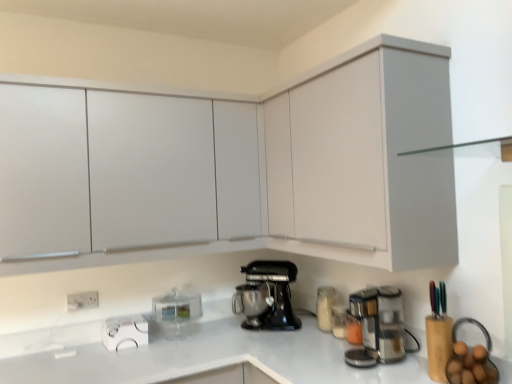
Question: From a real-world perspective, is stainless steel coffee maker at lower right above or below white plastic electric outlet at lower left?

Choices:
 (A) below
 (B) above

Answer: (A)

Question: Is stainless steel coffee maker at lower right inside or outside of white plastic electric outlet at lower left?

Choices:
 (A) inside
 (B) outside

Answer: (B)

Question: Estimate the real-world distances between objects in this image. Which object is farther from the white glossy kettle at lower left?

Choices:
 (A) white matte cabinet at upper left, which is counted as the third cabinetry, starting from the front
 (B) white plastic electric outlet at lower left
 (C) black matte stand mixer at center, which ranks as the second kitchen appliance in left-to-right order
 (D) matte white cabinet at upper center, which is the 3th cabinetry from back to front
 (E) white matte cabinet at upper right, which is counted as the 2th cabinetry, starting from the back

Answer: (E)

Question: Estimate the real-world distances between objects in this image. Which object is closer to the matte white cabinet at upper center, which appears as the 1th cabinetry when viewed from the front?

Choices:
 (A) white plastic electric outlet at lower left
 (B) white glossy kettle at lower left
 (C) stainless steel coffee maker at lower right
 (D) black matte stand mixer at center, which ranks as the second kitchen appliance in left-to-right order
 (E) white matte cabinet at upper right, the second cabinetry when ordered from front to back

Answer: (D)